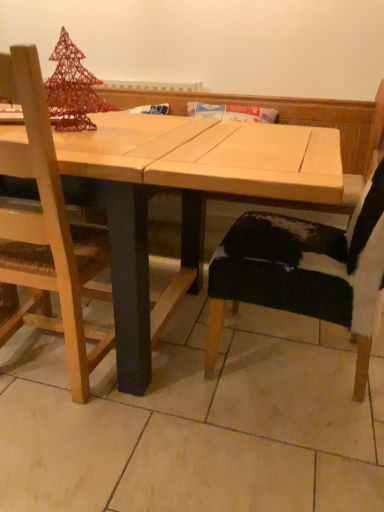
Image resolution: width=384 pixels, height=512 pixels. Find the location of `free point below cowhide black chair at lower right, acting as the first chair starting from the right (from a real-world perspective)`. free point below cowhide black chair at lower right, acting as the first chair starting from the right (from a real-world perspective) is located at coordinates (326, 366).